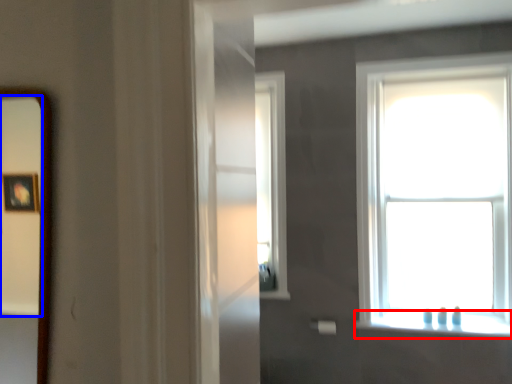
Question: Which of the following is the farthest to the observer, window sill (highlighted by a red box) or mirror (highlighted by a blue box)?

Choices:
 (A) window sill
 (B) mirror

Answer: (A)